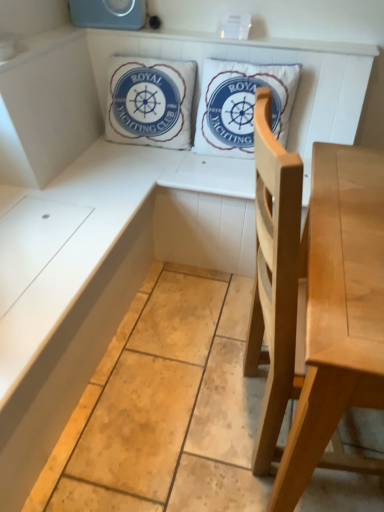
In order to face white cotton pillow at upper center, which appears as the second pillow when viewed from the left, should I rotate leftwards or rightwards?

It's best to rotate right around 6.708 degrees.

I want to click on light wood chair at center, so click(316, 302).

What do you see at coordinates (150, 101) in the screenshot?
I see `white cotton cushion at upper center, the 2th pillow when ordered from right to left` at bounding box center [150, 101].

Find the location of a particular element. This screenshot has height=512, width=384. white cotton pillow at upper center, which is the first pillow in right-to-left order is located at coordinates (241, 105).

Is white cotton cushion at upper center, the 1th pillow from the left, wider than light wood chair at center?

Incorrect, the width of white cotton cushion at upper center, the 1th pillow from the left, does not surpass that of light wood chair at center.

Can you confirm if white cotton cushion at upper center, the 1th pillow from the left, is positioned to the right of light wood chair at center?

In fact, white cotton cushion at upper center, the 1th pillow from the left, is to the left of light wood chair at center.

Considering the sizes of white cotton cushion at upper center, the 2th pillow when ordered from right to left, and light wood chair at center in the image, is white cotton cushion at upper center, the 2th pillow when ordered from right to left, taller or shorter than light wood chair at center?

Considering their sizes, white cotton cushion at upper center, the 2th pillow when ordered from right to left, has less height than light wood chair at center.

Choose the correct answer: Is white cotton cushion at upper center, the 1th pillow from the left, inside light wood chair at center or outside it?

white cotton cushion at upper center, the 1th pillow from the left, is not inside light wood chair at center, it's outside.

Visually, is light wood chair at center positioned to the left or to the right of white cotton cushion at upper center, the 1th pillow from the left?

From the image, it's evident that light wood chair at center is to the right of white cotton cushion at upper center, the 1th pillow from the left.

Is light wood chair at center directly adjacent to white cotton cushion at upper center, the 1th pillow from the left?

No, light wood chair at center is not with white cotton cushion at upper center, the 1th pillow from the left.

From a real-world perspective, starting from the light wood chair at center, which pillow is the 1st one vertically above it? Please provide its 2D coordinates.

[(150, 101)]

Is light wood chair at center wider or thinner than white cotton cushion at upper center, the 1th pillow from the left?

light wood chair at center is wider than white cotton cushion at upper center, the 1th pillow from the left.

Does white cotton pillow at upper center, which is the first pillow in right-to-left order, touch light wood chair at center?

There is a gap between white cotton pillow at upper center, which is the first pillow in right-to-left order, and light wood chair at center.

Is white cotton pillow at upper center, which is the first pillow in right-to-left order, facing away from light wood chair at center?

white cotton pillow at upper center, which is the first pillow in right-to-left order, does not have its back to light wood chair at center.

Considering the points (298, 73) and (297, 490), which point is behind, point (298, 73) or point (297, 490)?

Point (298, 73)

Who is shorter, white cotton pillow at upper center, which appears as the second pillow when viewed from the left, or light wood chair at center?

Standing shorter between the two is white cotton pillow at upper center, which appears as the second pillow when viewed from the left.

How far apart are white cotton pillow at upper center, which appears as the second pillow when viewed from the left, and white cotton cushion at upper center, the 2th pillow when ordered from right to left?

They are 8.98 inches apart.

Between white cotton pillow at upper center, which is the first pillow in right-to-left order, and white cotton cushion at upper center, the 1th pillow from the left, which one is positioned in front?

Positioned in front is white cotton pillow at upper center, which is the first pillow in right-to-left order.

Which object is positioned more to the right, white cotton pillow at upper center, which appears as the second pillow when viewed from the left, or white cotton cushion at upper center, the 2th pillow when ordered from right to left?

Positioned to the right is white cotton pillow at upper center, which appears as the second pillow when viewed from the left.

From the image's perspective, who appears lower, white cotton pillow at upper center, which appears as the second pillow when viewed from the left, or white cotton cushion at upper center, the 1th pillow from the left?

white cotton pillow at upper center, which appears as the second pillow when viewed from the left.

Is white cotton cushion at upper center, the 2th pillow when ordered from right to left, looking in the opposite direction of white cotton pillow at upper center, which appears as the second pillow when viewed from the left?

No, white cotton cushion at upper center, the 2th pillow when ordered from right to left,'s orientation is not away from white cotton pillow at upper center, which appears as the second pillow when viewed from the left.

This screenshot has height=512, width=384. In order to click on pillow that appears above the white cotton cushion at upper center, the 1th pillow from the left (from a real-world perspective) in this screenshot , I will do `click(241, 105)`.

From the image's perspective, who appears lower, white cotton cushion at upper center, the 2th pillow when ordered from right to left, or white cotton pillow at upper center, which appears as the second pillow when viewed from the left?

white cotton pillow at upper center, which appears as the second pillow when viewed from the left, is shown below in the image.

Is white cotton cushion at upper center, the 2th pillow when ordered from right to left, behind white cotton pillow at upper center, which is the first pillow in right-to-left order?

Yes.

From a real-world perspective, between light wood chair at center and white cotton pillow at upper center, which is the first pillow in right-to-left order, who is vertically lower?

light wood chair at center is physically lower.

From the image's perspective, who appears lower, light wood chair at center or white cotton pillow at upper center, which appears as the second pillow when viewed from the left?

light wood chair at center is shown below in the image.

Can you confirm if light wood chair at center is positioned to the left of white cotton pillow at upper center, which appears as the second pillow when viewed from the left?

No.

Can you tell me how much light wood chair at center and white cotton pillow at upper center, which appears as the second pillow when viewed from the left, differ in facing direction?

There is a 106-degree angle between the facing directions of light wood chair at center and white cotton pillow at upper center, which appears as the second pillow when viewed from the left.

Where is `chair below the white cotton cushion at upper center, the 2th pillow when ordered from right to left (from a real-world perspective)`? chair below the white cotton cushion at upper center, the 2th pillow when ordered from right to left (from a real-world perspective) is located at coordinates (316, 302).

The image size is (384, 512). Find the location of `chair in front of the white cotton cushion at upper center, the 1th pillow from the left`. chair in front of the white cotton cushion at upper center, the 1th pillow from the left is located at coordinates (316, 302).

Estimate the real-world distances between objects in this image. Which object is closer to white cotton cushion at upper center, the 2th pillow when ordered from right to left, white cotton pillow at upper center, which is the first pillow in right-to-left order, or light wood chair at center?

The object closer to white cotton cushion at upper center, the 2th pillow when ordered from right to left, is white cotton pillow at upper center, which is the first pillow in right-to-left order.

Considering their positions, is light wood chair at center positioned further to white cotton pillow at upper center, which appears as the second pillow when viewed from the left, than white cotton cushion at upper center, the 1th pillow from the left?

light wood chair at center is positioned further to the anchor white cotton pillow at upper center, which appears as the second pillow when viewed from the left.

Based on their spatial positions, is white cotton cushion at upper center, the 1th pillow from the left, or light wood chair at center closer to white cotton pillow at upper center, which appears as the second pillow when viewed from the left?

Among the two, white cotton cushion at upper center, the 1th pillow from the left, is located nearer to white cotton pillow at upper center, which appears as the second pillow when viewed from the left.

When comparing their distances from white cotton cushion at upper center, the 1th pillow from the left, does light wood chair at center or white cotton pillow at upper center, which is the first pillow in right-to-left order, seem closer?

white cotton pillow at upper center, which is the first pillow in right-to-left order, is positioned closer to the anchor white cotton cushion at upper center, the 1th pillow from the left.

Considering their positions, is white cotton cushion at upper center, the 2th pillow when ordered from right to left, positioned closer to light wood chair at center than white cotton pillow at upper center, which is the first pillow in right-to-left order?

white cotton pillow at upper center, which is the first pillow in right-to-left order, is closer to light wood chair at center.

From the image, which object appears to be farther from light wood chair at center, white cotton pillow at upper center, which appears as the second pillow when viewed from the left, or white cotton cushion at upper center, the 1th pillow from the left?

white cotton cushion at upper center, the 1th pillow from the left.

Locate an element on the screen. The height and width of the screenshot is (512, 384). pillow between light wood chair at center and white cotton cushion at upper center, the 1th pillow from the left, from front to back is located at coordinates [241, 105].